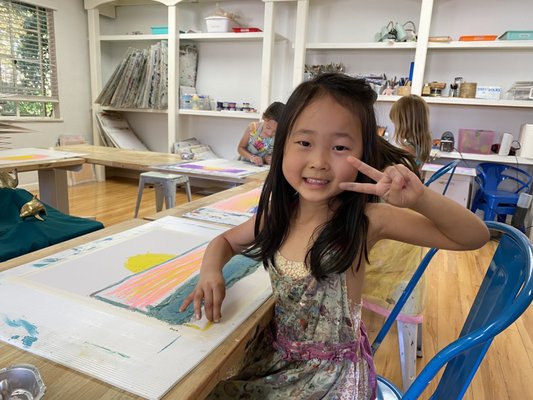
The image size is (533, 400). Identify the location of desks. (104, 389), (69, 161), (133, 154), (256, 173), (201, 201).